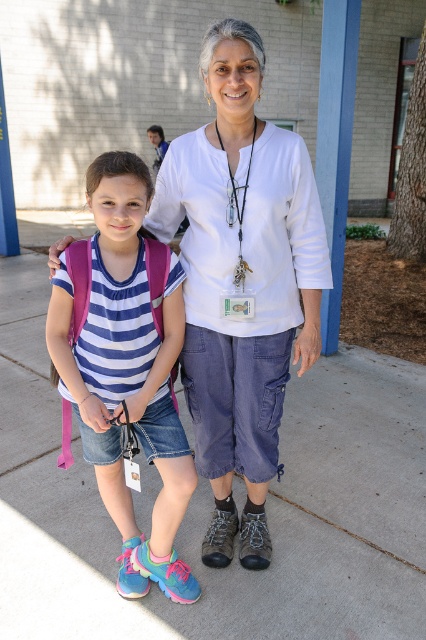
You are a photographer standing 10 feet away from the two people in the image. You want to take a photo that includes both the white cotton shirt at center and the blue striped shirt at center in the same frame. Given that your camera has a maximum horizontal field of view of 12 inches at this distance, will both shirts fit within the frame?

The white cotton shirt at center and blue striped shirt at center are 11.42 inches apart. Since the camera has a maximum horizontal field of view of 12 inches at this distance, both shirts will fit within the frame as 11.42 inches is less than 12 inches.

You are a delivery drone approaching the scene. You need to drop a package on the gray concrete pavement at center without hitting the blue striped shirt at center. Can you safely do so?

The gray concrete pavement at center is further to the viewer than the blue striped shirt at center, so the drone can safely drop the package on the gray concrete pavement at center without hitting the blue striped shirt at center.

You are taking a photo of two people standing on a paved area near a school. You want to focus on the person closer to the camera. Which point should you aim at, point (324, 428) or point (170, 528)?

Point (324, 428) is further to the camera than point (170, 528), so you should aim at point (324, 428) to focus on the person closer to the camera.